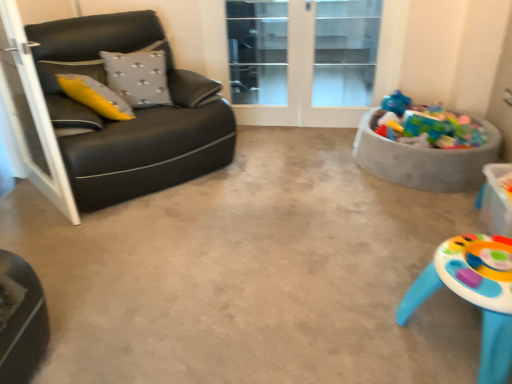
Find the location of a particular element. This screenshot has height=384, width=512. free area in between transparent glass screen door at upper center, which is the 2th screen door from left to right, and plastic colorful toys at right is located at coordinates (309, 142).